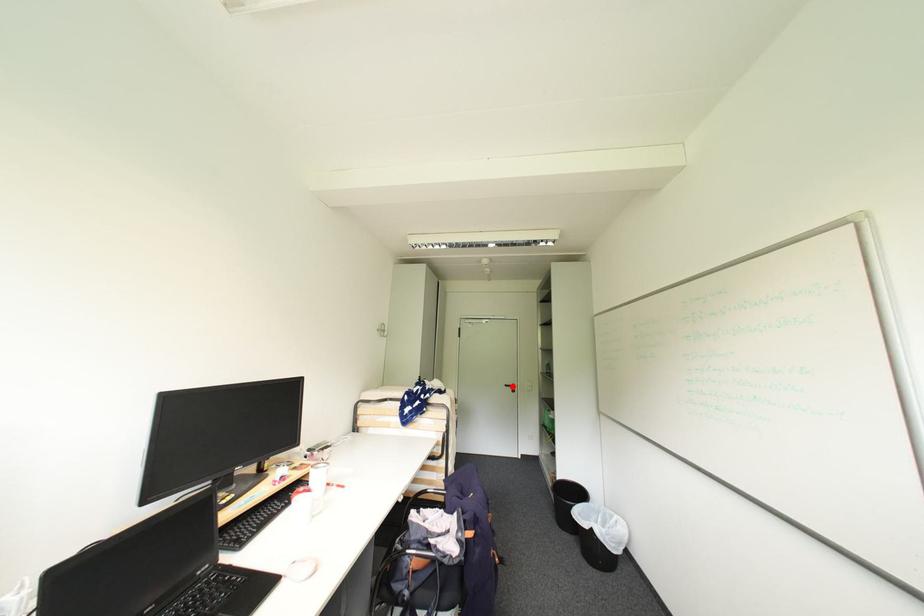
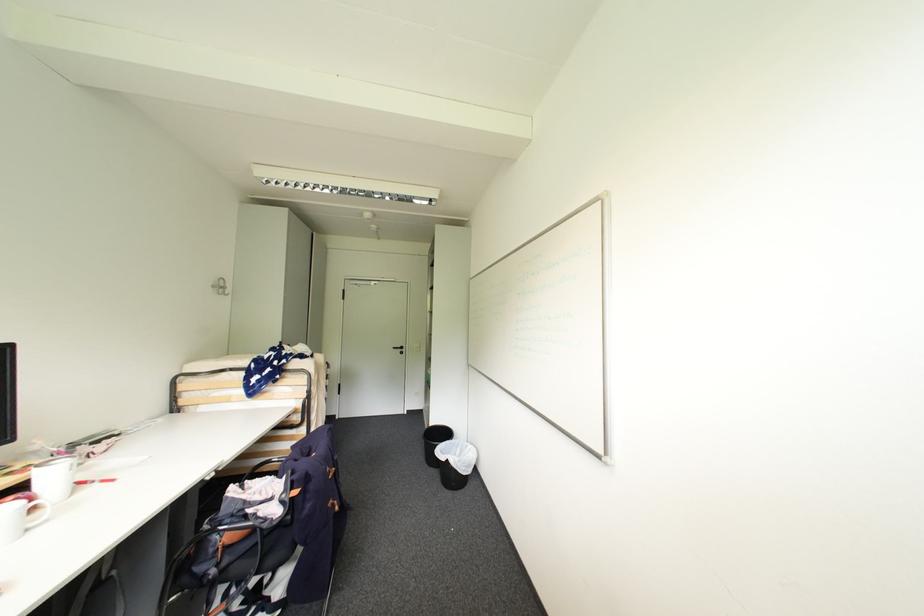
Find the pixel in the second image that matches the highlighted location in the first image.

(400, 349)